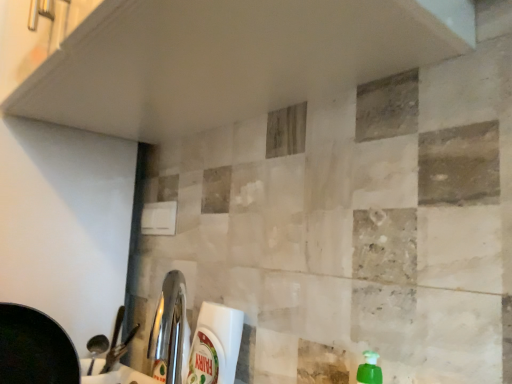
Question: From the image's perspective, does white glossy countertop at lower left appear lower than white plastic bottle at lower center?

Choices:
 (A) no
 (B) yes

Answer: (B)

Question: Is white glossy countertop at lower left taller than white plastic bottle at lower center?

Choices:
 (A) no
 (B) yes

Answer: (A)

Question: From a real-world perspective, is white glossy countertop at lower left positioned under white plastic bottle at lower center based on gravity?

Choices:
 (A) no
 (B) yes

Answer: (B)

Question: Does white glossy countertop at lower left touch white plastic bottle at lower center?

Choices:
 (A) no
 (B) yes

Answer: (A)

Question: Does white glossy countertop at lower left come in front of white plastic bottle at lower center?

Choices:
 (A) yes
 (B) no

Answer: (A)

Question: From a real-world perspective, is white glossy countertop at lower left on top of white plastic bottle at lower center?

Choices:
 (A) no
 (B) yes

Answer: (A)

Question: Considering the relative sizes of white plastic bottle at lower center and white glossy countertop at lower left in the image provided, is white plastic bottle at lower center thinner than white glossy countertop at lower left?

Choices:
 (A) yes
 (B) no

Answer: (A)

Question: Is white plastic bottle at lower center outside of white glossy countertop at lower left?

Choices:
 (A) yes
 (B) no

Answer: (A)

Question: Are white plastic bottle at lower center and white glossy countertop at lower left beside each other?

Choices:
 (A) no
 (B) yes

Answer: (A)

Question: Does white plastic bottle at lower center have a greater width compared to white glossy countertop at lower left?

Choices:
 (A) yes
 (B) no

Answer: (B)

Question: Considering the relative positions of white plastic bottle at lower center and white glossy countertop at lower left in the image provided, is white plastic bottle at lower center to the left of white glossy countertop at lower left from the viewer's perspective?

Choices:
 (A) no
 (B) yes

Answer: (A)

Question: From a real-world perspective, is white plastic bottle at lower center physically below white glossy countertop at lower left?

Choices:
 (A) no
 (B) yes

Answer: (A)

Question: Is white plastic bottle at lower center bigger or smaller than white glossy countertop at lower left?

Choices:
 (A) small
 (B) big

Answer: (B)